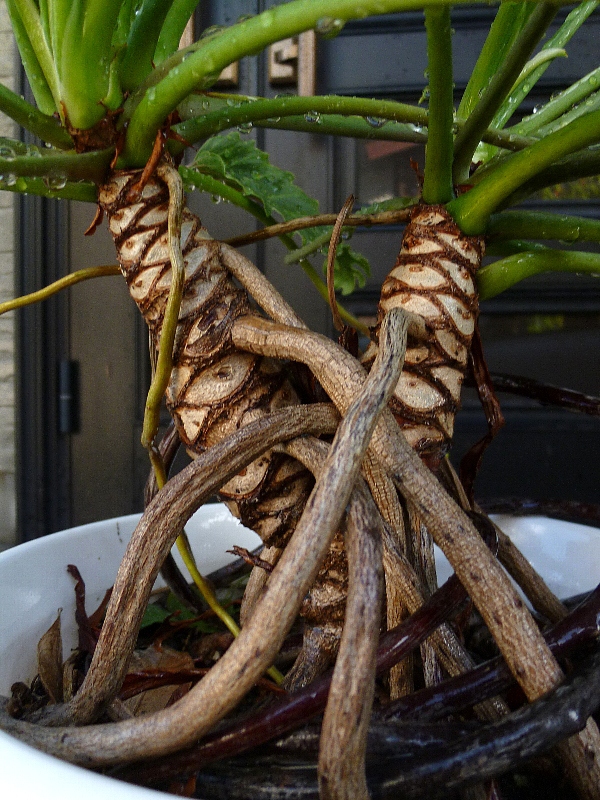
Locate an element on the screen. Image resolution: width=600 pixels, height=800 pixels. hinge is located at coordinates (74, 394).